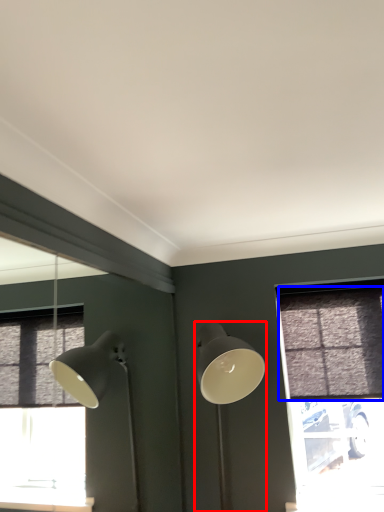
Question: Among these objects, which one is nearest to the camera, lamp (highlighted by a red box) or curtain (highlighted by a blue box)?

Choices:
 (A) lamp
 (B) curtain

Answer: (A)